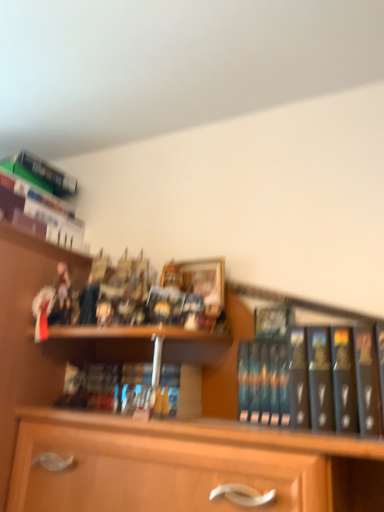
Question: Do you think hardcover book at upper left, the third book ordered from the bottom, is within hardcover books at center, positioned as the 1th book in bottom-to-top order, or outside of it?

Choices:
 (A) outside
 (B) inside

Answer: (A)

Question: Is hardcover book at upper left, which is counted as the third book, starting from the front, wider or thinner than hardcover books at center, which is counted as the second book, starting from the right?

Choices:
 (A) thin
 (B) wide

Answer: (B)

Question: Estimate the real-world distances between objects in this image. Which object is farther from the hardcover books at center, which is the 3th book in top-to-bottom order?

Choices:
 (A) wooden figurines at left
 (B) black matte book at right, the third book from the left
 (C) hardcover book at upper left, which is the 3th book in right-to-left order

Answer: (C)

Question: Which object is positioned farthest from the black matte book at right, the 1th book when ordered from front to back?

Choices:
 (A) hardcover book at upper left, which is counted as the first book, starting from the top
 (B) wooden figurines at left
 (C) hardcover books at center, the second book in the front-to-back sequence

Answer: (A)